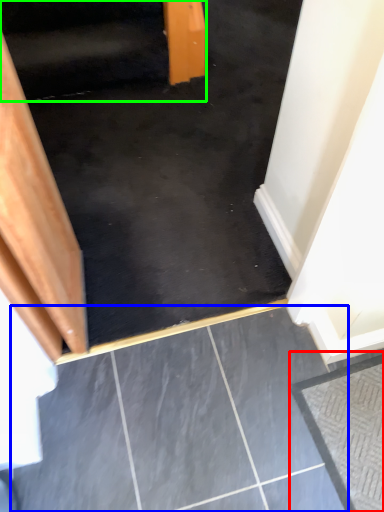
Question: Based on their relative distances, which object is nearer to concrete (highlighted by a red box)? Choose from concrete (highlighted by a blue box) and stairwell (highlighted by a green box).

Choices:
 (A) concrete
 (B) stairwell

Answer: (A)